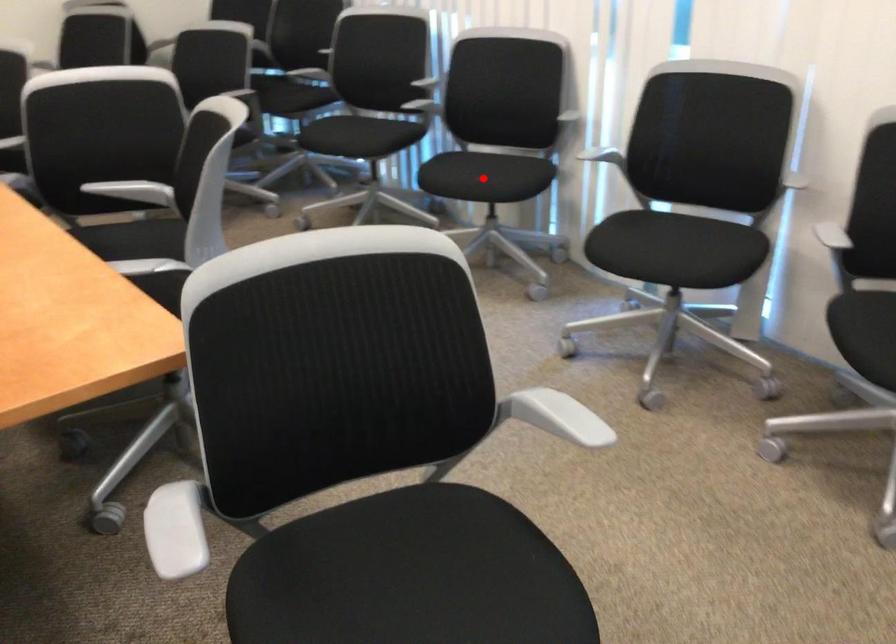
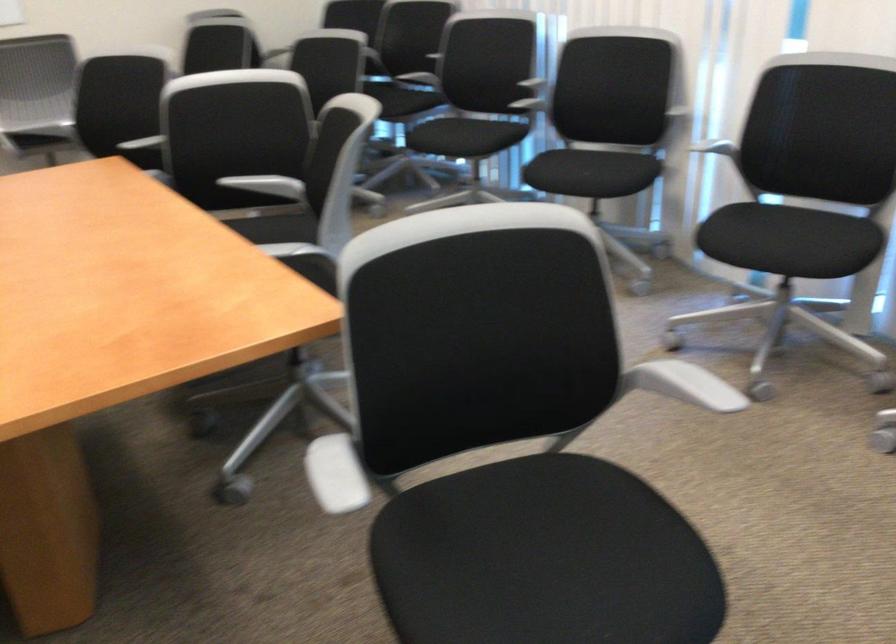
The point at the highlighted location is marked in the first image. Where is the corresponding point in the second image?

(587, 174)